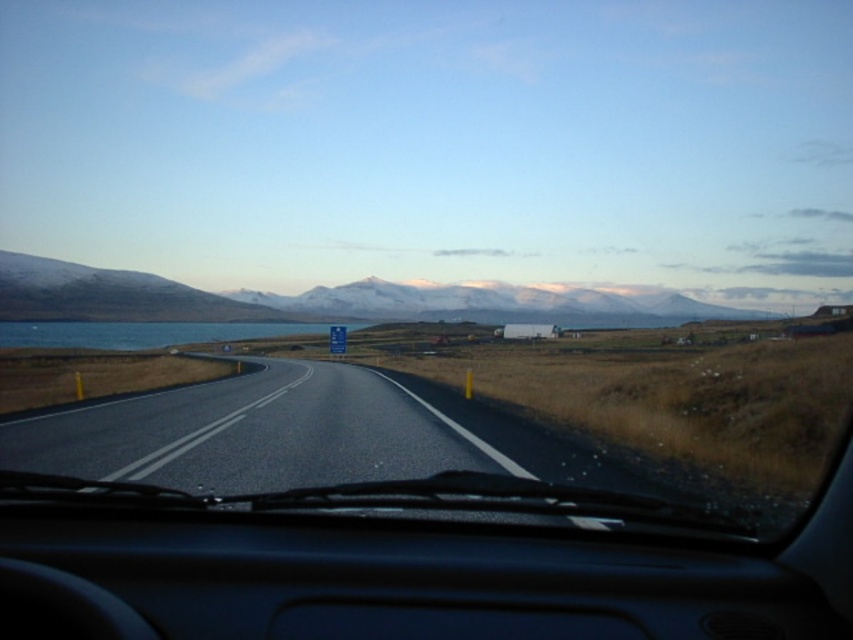
Question: Which point is closer to the camera taking this photo?

Choices:
 (A) (554, 308)
 (B) (227, 324)

Answer: (B)

Question: Observing the image, what is the correct spatial positioning of snowy mountain at center in reference to blue water at left?

Choices:
 (A) above
 (B) below

Answer: (A)

Question: Which object appears closest to the camera in this image?

Choices:
 (A) blue water at left
 (B) snowy mountain at center

Answer: (A)

Question: Does snowy mountain at center appear under blue water at left?

Choices:
 (A) yes
 (B) no

Answer: (B)

Question: Observing the image, what is the correct spatial positioning of snowy mountain at center in reference to blue water at left?

Choices:
 (A) above
 (B) below

Answer: (A)